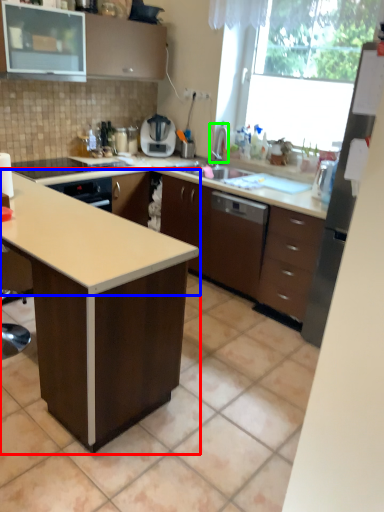
Question: Which is nearer to the table (highlighted by a red box)? countertop (highlighted by a blue box) or faucet (highlighted by a green box).

Choices:
 (A) countertop
 (B) faucet

Answer: (A)